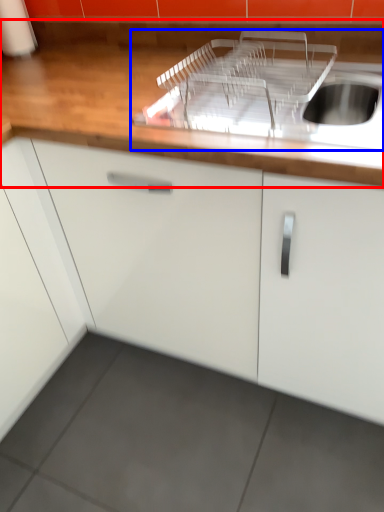
Question: Which object is further to the camera taking this photo, countertop (highlighted by a red box) or sink (highlighted by a blue box)?

Choices:
 (A) countertop
 (B) sink

Answer: (B)